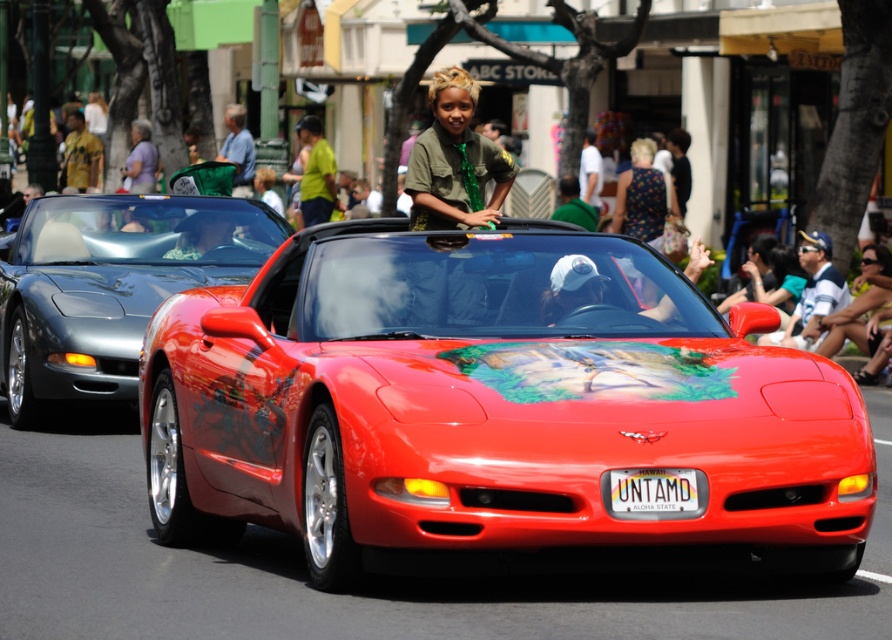
You are a photographer standing at the point labeled point (75, 364). You want to take a photo of the point labeled point (700, 502). However, there is a Chevrolet Corvette in the way. Can you still take the photo without moving your position?

Point (75, 364) is behind point (700, 502), so you can still take the photo because the Chevrolet Corvette would be in front of point (75, 364), but the target point (700, 502) is in front of the Corvette and thus visible.

You are a photographer positioned on the street. You want to take a photo of the white plastic license plate at center without the shiny metallic car at left blocking the view. Is this possible?

The shiny metallic car at left is further to the viewer than the white plastic license plate at center, so the car is closer to you. Therefore, the shiny metallic car at left will block the view of the white plastic license plate at center, making it impossible to take a clear photo without obstruction.

Based on the scene description, where exactly is the shiny metallic car at left located in the image?

The shiny metallic car at left is located at point (109, 285).